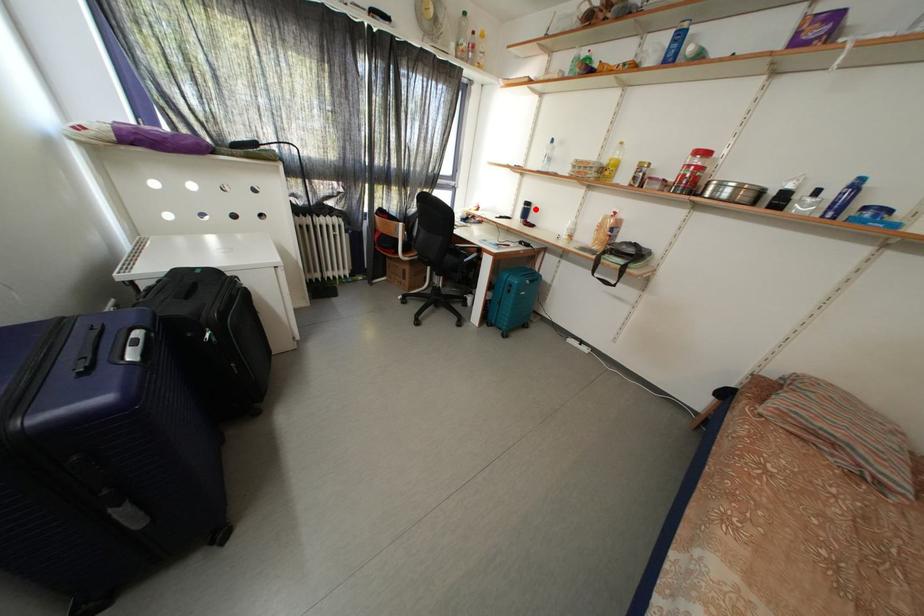
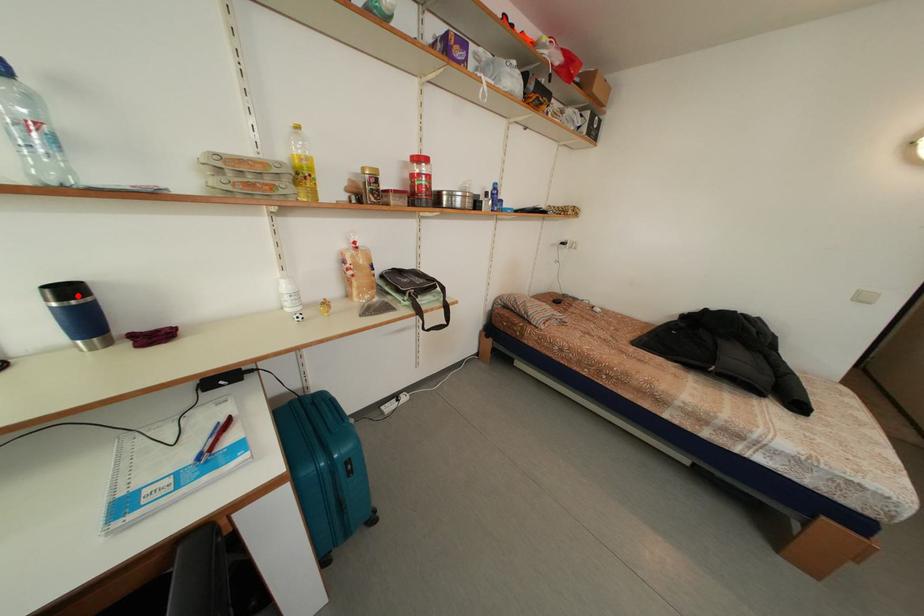
I am providing you with two images of the same scene from different viewpoints. A red point is marked on the first image and another point is marked on the second image. Are the points marked in image1 and image2 representing the same 3D position?

Yes